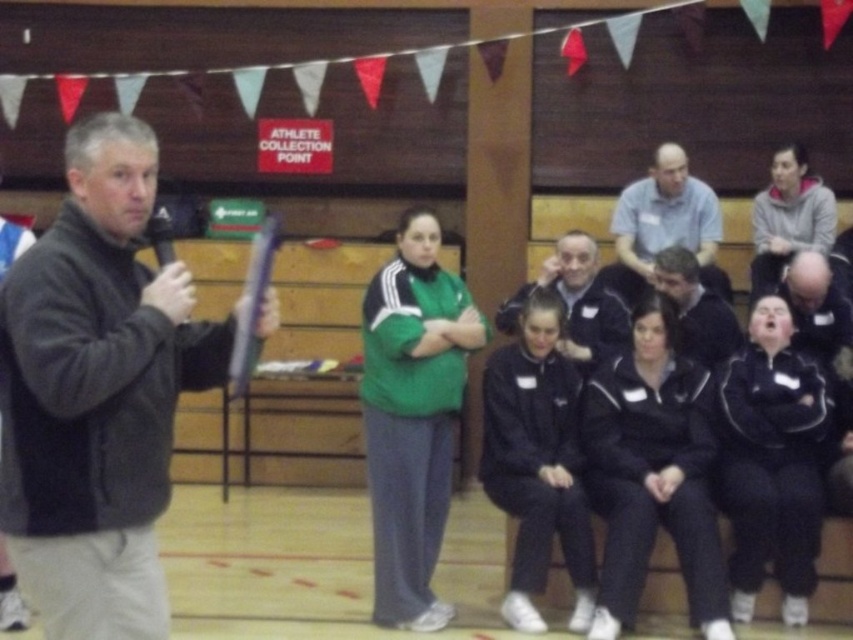
Between black matte jacket at left and light blue shirt at upper center, which one appears on the left side from the viewer's perspective?

From the viewer's perspective, black matte jacket at left appears more on the left side.

Can you confirm if black matte jacket at left is positioned to the right of light blue shirt at upper center?

Incorrect, black matte jacket at left is not on the right side of light blue shirt at upper center.

Locate an element on the screen. black matte jacket at left is located at coordinates (96, 392).

This screenshot has height=640, width=853. I want to click on black matte jacket at left, so click(x=96, y=392).

Does black matte jacket at left appear under dark blue jacket at center?

Yes.

Can you confirm if black matte jacket at left is positioned to the right of dark blue jacket at center?

No, black matte jacket at left is not to the right of dark blue jacket at center.

What are the coordinates of `black matte jacket at left` in the screenshot? It's located at (96, 392).

Is dark blue jacket at center to the right of dark gray jacket at center from the viewer's perspective?

Incorrect, dark blue jacket at center is not on the right side of dark gray jacket at center.

Looking at this image, does dark blue jacket at center appear under dark gray jacket at center?

No.

Does point (576, 284) come closer to viewer compared to point (712, 296)?

No, it is behind (712, 296).

At what (x,y) coordinates should I click in order to perform the action: click on dark blue jacket at center. Please return your answer as a coordinate pair (x, y). Looking at the image, I should click on (575, 304).